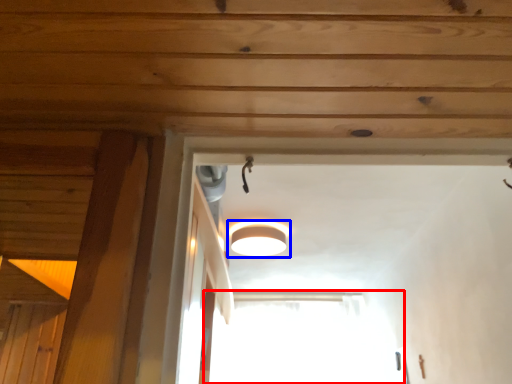
Question: Which point is closer to the camera, window (highlighted by a red box) or lamp (highlighted by a blue box)?

Choices:
 (A) window
 (B) lamp

Answer: (B)